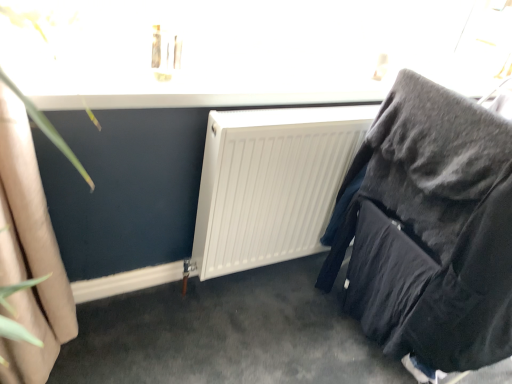
Locate an element on the screen. Image resolution: width=512 pixels, height=384 pixels. free space to the left of velvet black chair at right is located at coordinates (266, 336).